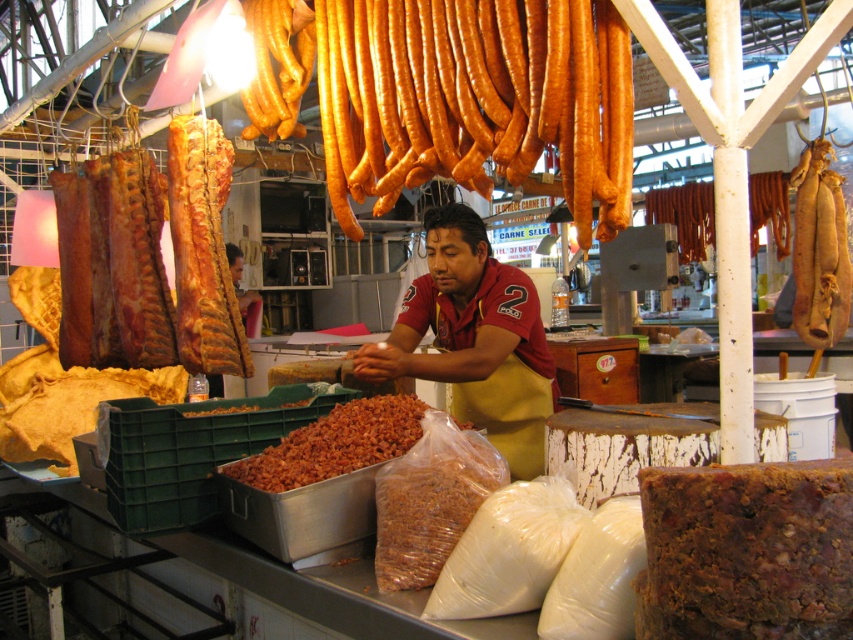
Question: Estimate the real-world distances between objects in this image. Which object is farther from the brown crumbly snack at center?

Choices:
 (A) brown apron at center
 (B) shiny brown sausages at upper center
 (C) brown matte dried beans at center

Answer: (B)

Question: Which object is positioned farthest from the shiny brown sausages at upper center?

Choices:
 (A) brown crumbly food at center
 (B) brown crumbly meatloaf at center
 (C) brown matte dried beans at center
 (D) brown apron at center

Answer: (B)

Question: Is brown crumbly meatloaf at center smaller than brown crumbly snack at center?

Choices:
 (A) no
 (B) yes

Answer: (B)

Question: Which point is farther to the camera?

Choices:
 (A) (340, 420)
 (B) (585, 33)
 (C) (432, 410)
 (D) (772, 630)

Answer: (A)

Question: Does brown matte dried beans at center have a greater width compared to brown crumbly food at center?

Choices:
 (A) no
 (B) yes

Answer: (A)

Question: Can you confirm if brown matte dried beans at center is positioned below brown crumbly food at center?

Choices:
 (A) yes
 (B) no

Answer: (A)